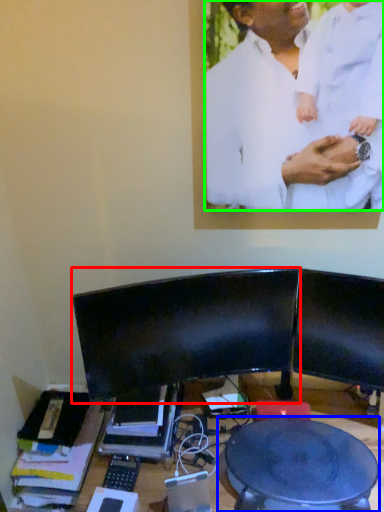
Question: Which object is positioned farthest from computer monitor (highlighted by a red box)? Select from round table (highlighted by a blue box) and man (highlighted by a green box).

Choices:
 (A) round table
 (B) man

Answer: (B)